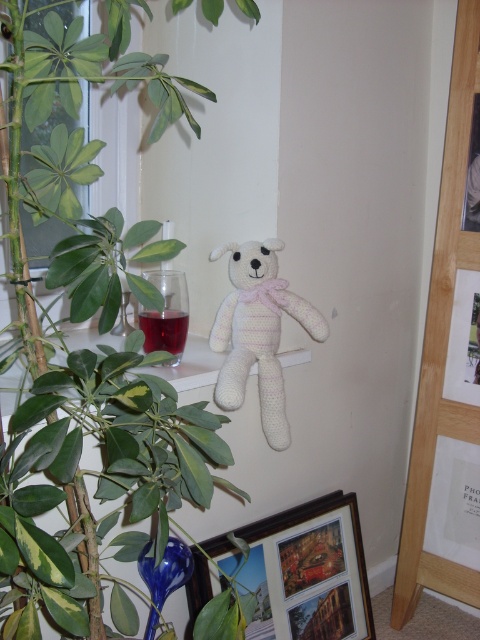
In the scene shown: Does green leafy plant at upper left appear on the right side of white knitted bear at center?

In fact, green leafy plant at upper left is to the left of white knitted bear at center.

Is green leafy plant at upper left to the left of white knitted bear at center from the viewer's perspective?

Yes, green leafy plant at upper left is to the left of white knitted bear at center.

Is point (40, 378) closer to viewer compared to point (240, 252)?

That is True.

The height and width of the screenshot is (640, 480). Find the location of `green leafy plant at upper left`. green leafy plant at upper left is located at coordinates (71, 301).

From the picture: Is green leafy plant at upper left thinner than wooden framed photo at lower center?

Incorrect, green leafy plant at upper left's width is not less than wooden framed photo at lower center's.

Between green leafy plant at upper left and wooden framed photo at lower center, which one appears on the left side from the viewer's perspective?

green leafy plant at upper left

Which is behind, point (14, 566) or point (321, 579)?

Point (321, 579)

Identify the location of green leafy plant at upper left. The height and width of the screenshot is (640, 480). (71, 301).

Which is more to the left, wooden framed photo at lower center or white knitted bear at center?

From the viewer's perspective, white knitted bear at center appears more on the left side.

Can you confirm if wooden framed photo at lower center is positioned to the right of white knitted bear at center?

Correct, you'll find wooden framed photo at lower center to the right of white knitted bear at center.

Who is more forward, (268, 531) or (228, 330)?

Point (228, 330) is in front.

What are the coordinates of `wooden framed photo at lower center` in the screenshot? It's located at (309, 572).